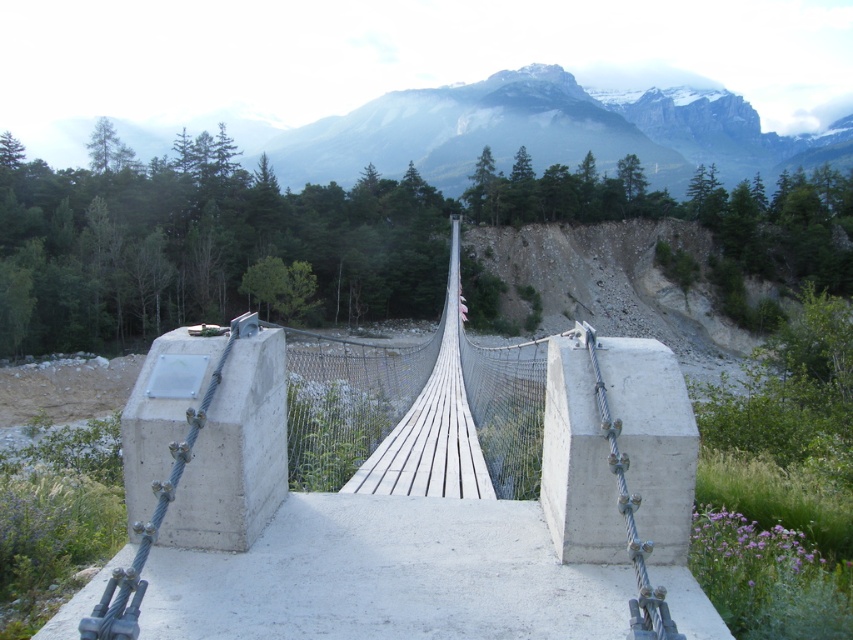
You are standing at the starting point of the bridge and want to reach the end. Based on the coordinates provided, in which direction should you walk to reach the end of the white concrete suspension bridge at center?

The white concrete suspension bridge at center is located at coordinates point (392,516). Since you are at the starting point, you should walk towards the direction of increasing x and y coordinates to reach the end of the bridge.

You are standing on the white concrete suspension bridge at center and looking towards the gray rocky mountain at upper center. Which object is closer to your viewpoint?

The white concrete suspension bridge at center is closer to your viewpoint because it is in front of the gray rocky mountain at upper center.